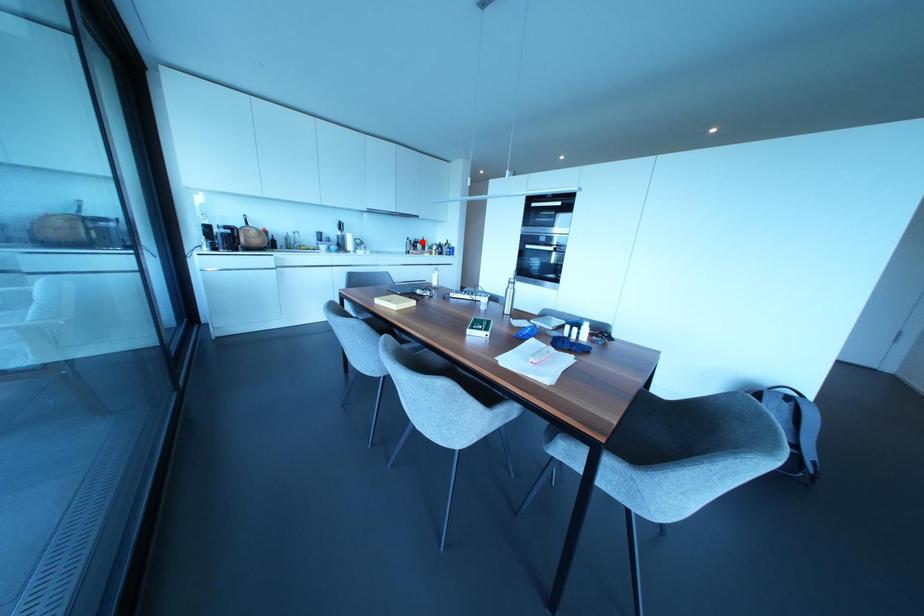
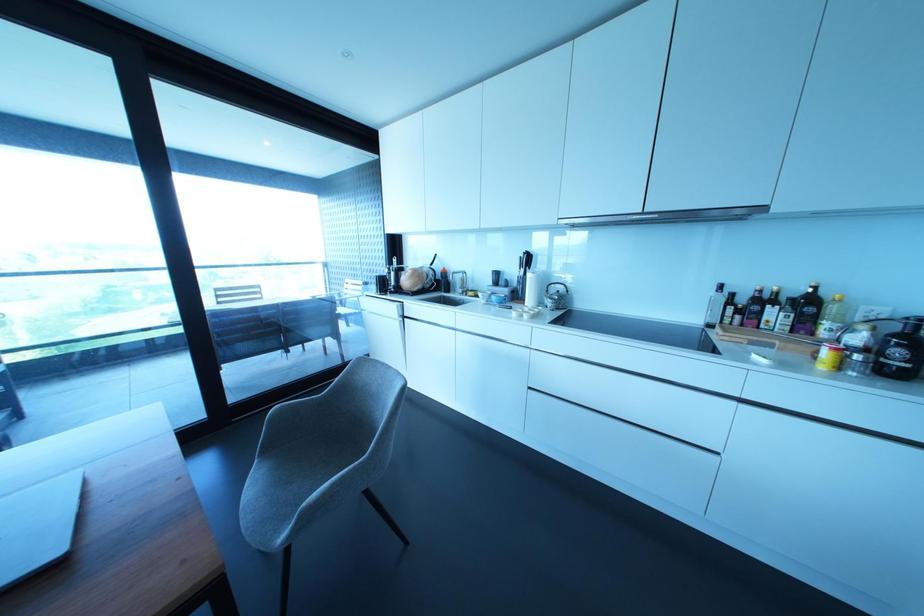
Question: A red point is marked in image1. In image2, is the corresponding 3D point closer to the camera or farther? Reply with the corresponding letter.

Choices:
 (A) The corresponding 3D point is closer.
 (B) The corresponding 3D point is farther.

Answer: (B)